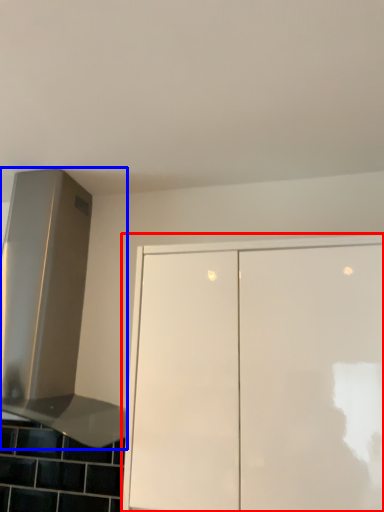
Question: Which of the following is the farthest to the observer, cabinetry (highlighted by a red box) or vent (highlighted by a blue box)?

Choices:
 (A) cabinetry
 (B) vent

Answer: (B)